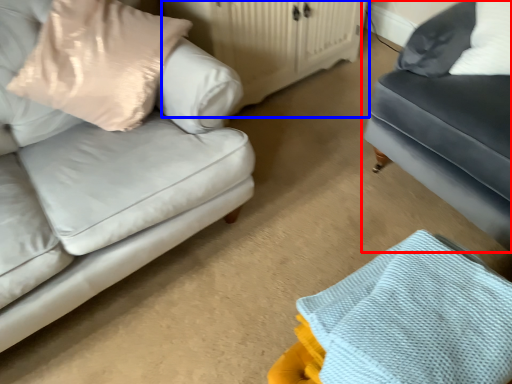
Question: Which object appears farthest to the camera in this image, studio couch (highlighted by a red box) or dresser (highlighted by a blue box)?

Choices:
 (A) studio couch
 (B) dresser

Answer: (B)